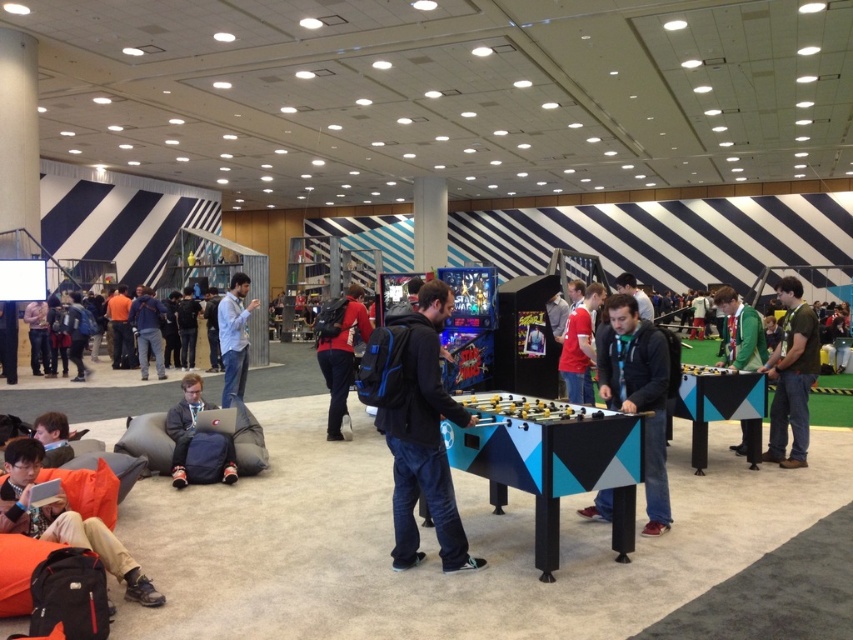
Does matte black backpack at center lie in front of red jersey at center?

No, it is behind red jersey at center.

In order to click on matte black backpack at center in this screenshot , I will do `click(339, 352)`.

Who is more forward, (128, 568) or (732, 336)?

Point (128, 568) is in front.

Between point (51, 516) and point (750, 333), which one is positioned in front?

Positioned in front is point (51, 516).

Where is `orange fabric bean bag at lower left`? orange fabric bean bag at lower left is located at coordinates (64, 522).

Can you confirm if matte black foosball table at center is thinner than blue denim jeans at lower left?

In fact, matte black foosball table at center might be wider than blue denim jeans at lower left.

Who is positioned more to the left, matte black foosball table at center or blue denim jeans at lower left?

Positioned to the left is blue denim jeans at lower left.

Who is more distant from viewer, [645,496] or [180,378]?

The point [180,378] is more distant.

Where is `matte black foosball table at center`? The image size is (853, 640). matte black foosball table at center is located at coordinates tap(637, 392).